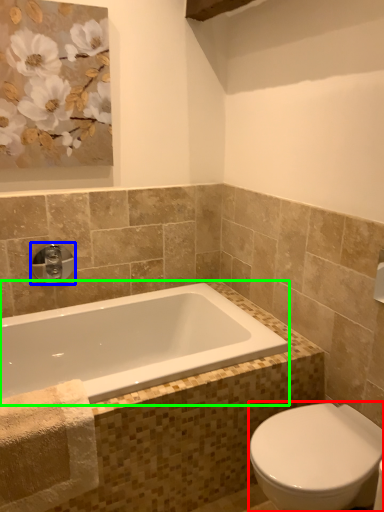
Question: Considering the real-world distances, which object is closest to bidet (highlighted by a red box)? tap (highlighted by a blue box) or bathtub (highlighted by a green box).

Choices:
 (A) tap
 (B) bathtub

Answer: (B)